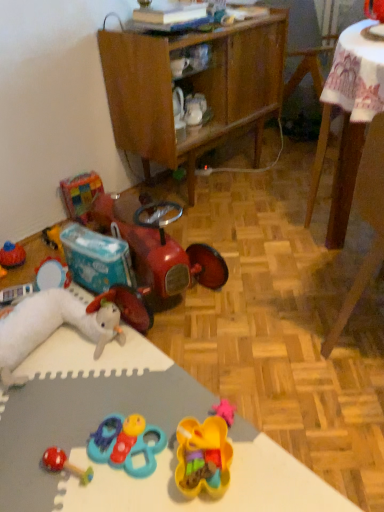
Where is `vacant space that's between translucent plastic container at center, the fifth toy viewed from the left, and white plush rabbit at lower left, arranged as the sixth toy when viewed from the right`? vacant space that's between translucent plastic container at center, the fifth toy viewed from the left, and white plush rabbit at lower left, arranged as the sixth toy when viewed from the right is located at coordinates (119, 395).